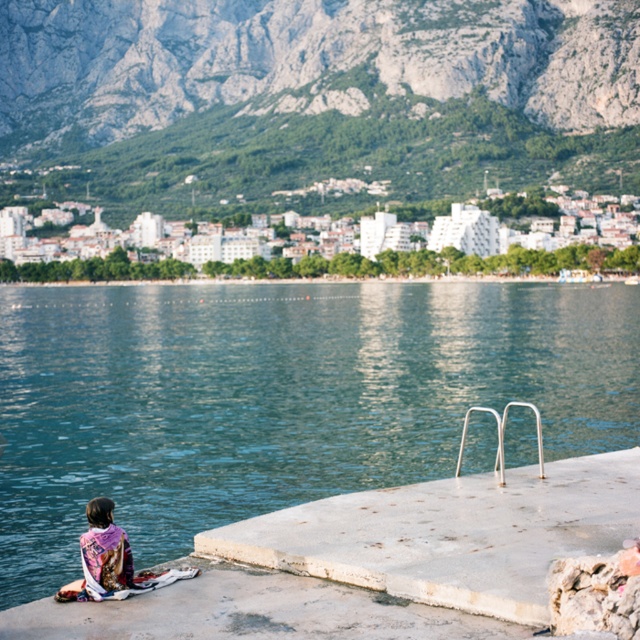
Is teal concrete water at lower left to the left of printed fabric scarf at lower left from the viewer's perspective?

In fact, teal concrete water at lower left is to the right of printed fabric scarf at lower left.

The width and height of the screenshot is (640, 640). I want to click on teal concrete water at lower left, so click(276, 397).

Is point (156, 52) more distant than point (86, 547)?

Yes, it is.

Is point (99, 125) behind point (96, 568)?

That is True.

Locate an element on the screen. This screenshot has width=640, height=640. gray rocky mountain at upper center is located at coordinates (314, 100).

How distant is teal concrete water at lower left from gray rocky mountain at upper center?

teal concrete water at lower left is 105.10 meters from gray rocky mountain at upper center.

Can you confirm if teal concrete water at lower left is positioned above gray rocky mountain at upper center?

No, teal concrete water at lower left is not above gray rocky mountain at upper center.

Who is more distant from viewer, (588, 369) or (554, 134)?

The point (554, 134) is behind.

The height and width of the screenshot is (640, 640). Identify the location of teal concrete water at lower left. (276, 397).